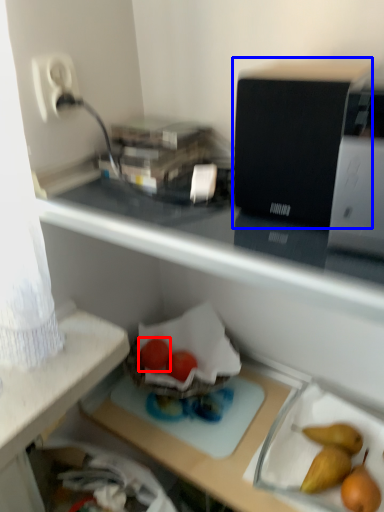
Question: Among these objects, which one is nearest to the camera, green vegetables (highlighted by a red box) or appliance (highlighted by a blue box)?

Choices:
 (A) green vegetables
 (B) appliance

Answer: (B)